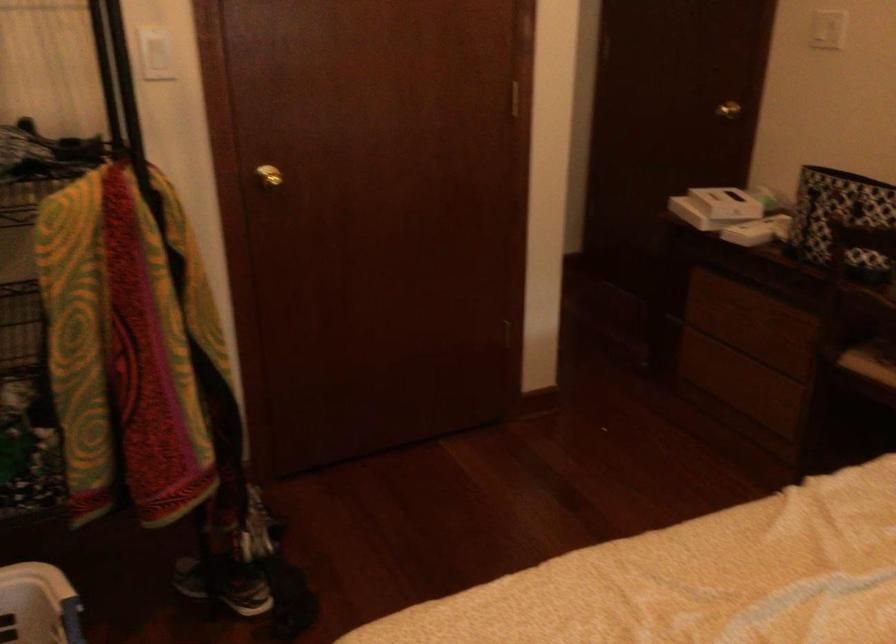
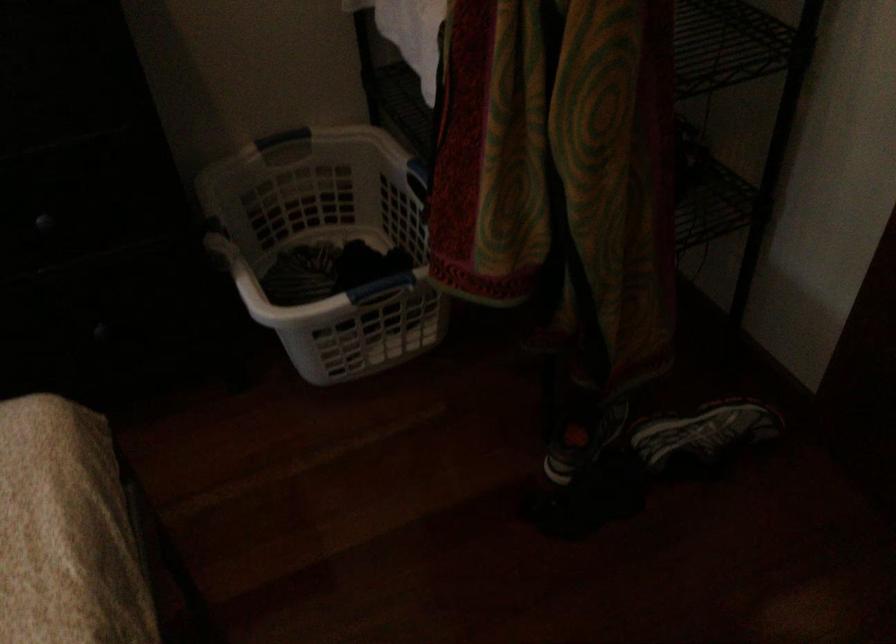
Question: I am providing you with two images of the same scene from different viewpoints. After the viewpoint changes to image2, which objects are now occluded?

Choices:
 (A) black running shoe
 (B) white box
 (C) blue basket handle
 (D) silver thermos handle

Answer: (B)